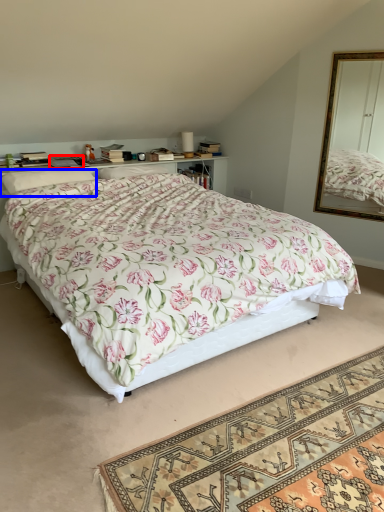
Question: Which object is further to the camera taking this photo, book (highlighted by a red box) or pillow (highlighted by a blue box)?

Choices:
 (A) book
 (B) pillow

Answer: (A)